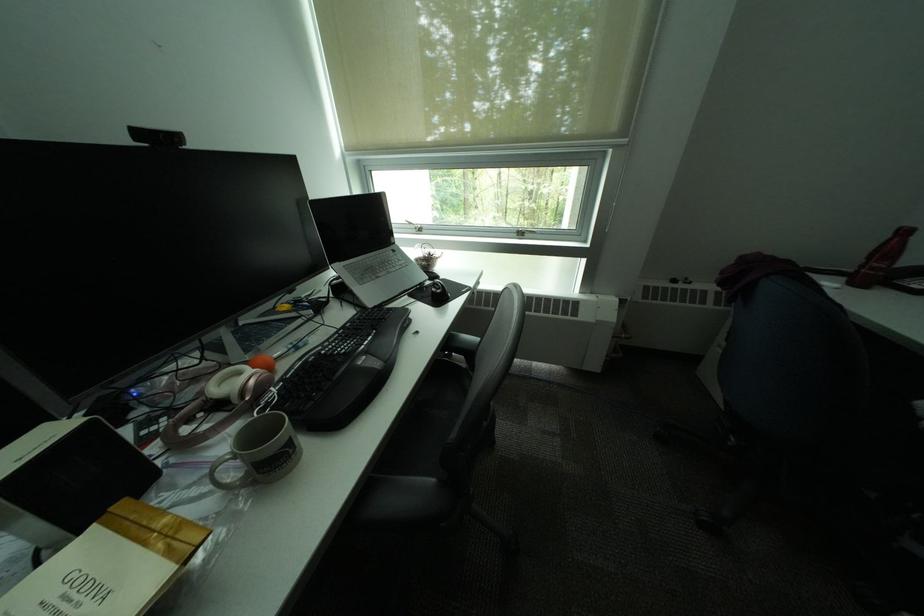
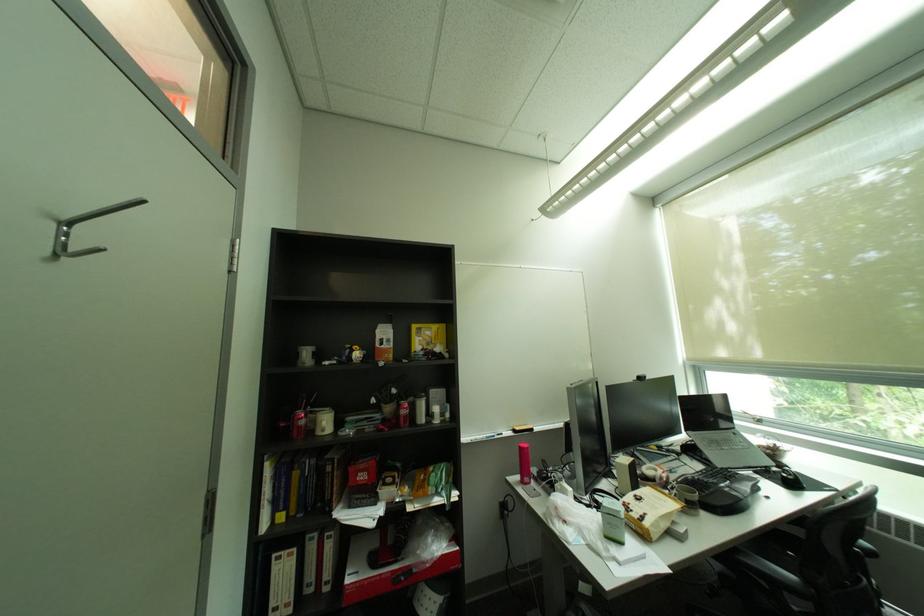
Find the pixel in the second image that matches the point at 263,464 in the first image.

(697, 500)